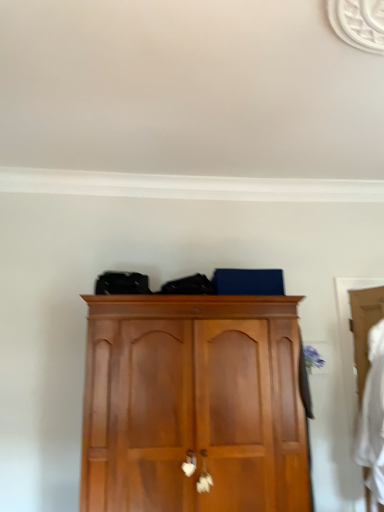
Question: Considering the relative sizes of wooden cupboard at center and wooden wardrobe at right in the image provided, is wooden cupboard at center shorter than wooden wardrobe at right?

Choices:
 (A) no
 (B) yes

Answer: (A)

Question: Can wooden wardrobe at right be found inside wooden cupboard at center?

Choices:
 (A) yes
 (B) no

Answer: (A)

Question: Does wooden cupboard at center have a greater height compared to wooden wardrobe at right?

Choices:
 (A) no
 (B) yes

Answer: (B)

Question: Does wooden cupboard at center have a lesser width compared to wooden wardrobe at right?

Choices:
 (A) yes
 (B) no

Answer: (B)

Question: Is wooden cupboard at center beside wooden wardrobe at right?

Choices:
 (A) yes
 (B) no

Answer: (B)

Question: Based on their sizes in the image, would you say wooden cupboard at center is bigger or smaller than wooden wardrobe at right?

Choices:
 (A) big
 (B) small

Answer: (A)

Question: In terms of height, does wooden cupboard at center look taller or shorter compared to wooden wardrobe at right?

Choices:
 (A) short
 (B) tall

Answer: (B)

Question: From a real-world perspective, relative to wooden wardrobe at right, is wooden cupboard at center vertically above or below?

Choices:
 (A) above
 (B) below

Answer: (B)

Question: In the image, is wooden cupboard at center on the left side or the right side of wooden wardrobe at right?

Choices:
 (A) left
 (B) right

Answer: (A)

Question: Is wooden cupboard at center taller or shorter than white fabric at right?

Choices:
 (A) tall
 (B) short

Answer: (A)

Question: Based on their sizes in the image, would you say wooden cupboard at center is bigger or smaller than white fabric at right?

Choices:
 (A) big
 (B) small

Answer: (A)

Question: From a real-world perspective, relative to white fabric at right, is wooden cupboard at center vertically above or below?

Choices:
 (A) below
 (B) above

Answer: (B)

Question: Relative to white fabric at right, is wooden cupboard at center in front or behind?

Choices:
 (A) front
 (B) behind

Answer: (A)

Question: From a real-world perspective, relative to wooden wardrobe at right, is white fabric at right vertically above or below?

Choices:
 (A) below
 (B) above

Answer: (A)

Question: Is white fabric at right to the left or to the right of wooden wardrobe at right in the image?

Choices:
 (A) left
 (B) right

Answer: (B)